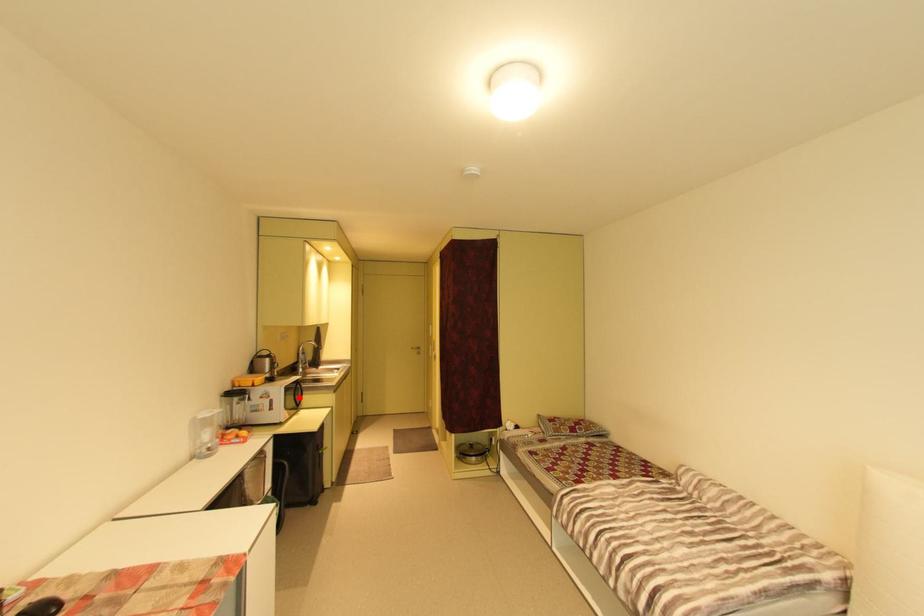
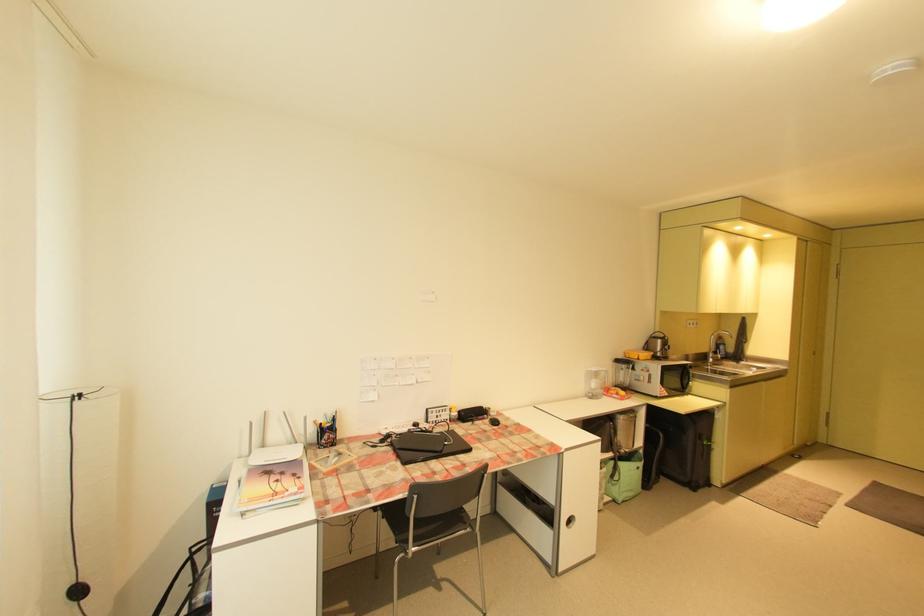
Find the pixel in the second image that matches the highlighted location in the first image.

(686, 381)